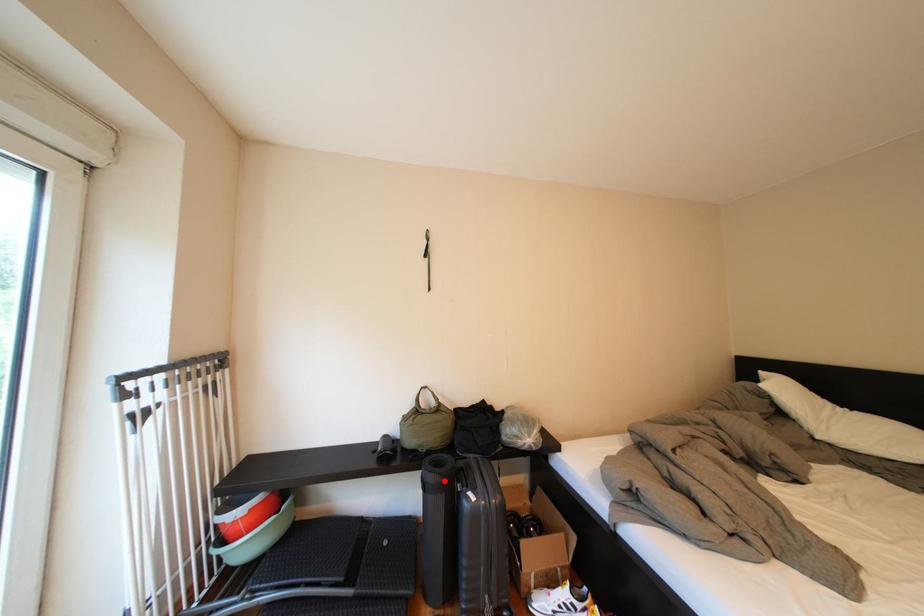
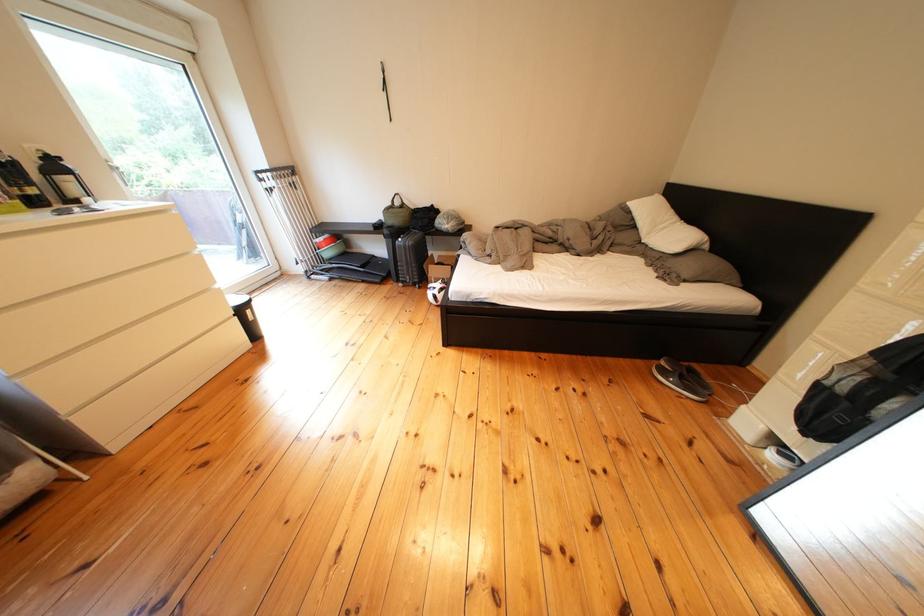
The point at the highlighted location is marked in the first image. Where is the corresponding point in the second image?

(399, 236)